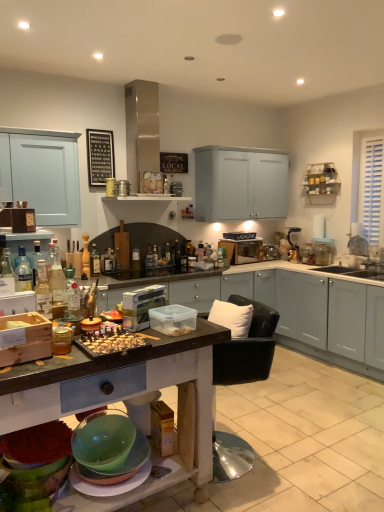
Find the location of a particular element. This screenshot has height=512, width=384. unoccupied area in front of translucent glass bottle at center, the 5th bottle in the front-to-back sequence is located at coordinates (145, 273).